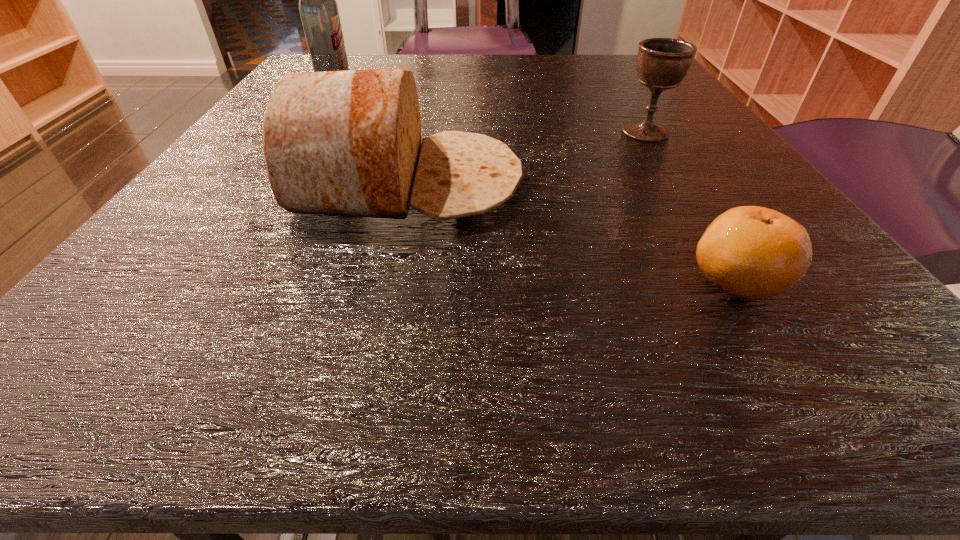
Find the location of a particular element. Image resolution: width=960 pixels, height=540 pixels. vacant space that's between the nearest object and the vodka is located at coordinates (535, 179).

Identify the location of free space between the second object from left to right and the nearest object. (572, 231).

Locate an element on the screen. The width and height of the screenshot is (960, 540). vacant point located between the nearest object and the chalice is located at coordinates (691, 206).

This screenshot has height=540, width=960. Find the location of `the second closest object to the shortest object`. the second closest object to the shortest object is located at coordinates [x=662, y=63].

Identify which object is located as the nearest to the leftmost object. Please provide its 2D coordinates. Your answer should be formatted as a tuple, i.e. [(x, y)], where the tuple contains the x and y coordinates of a point satisfying the conditions above.

[(345, 143)]

What are the coordinates of `free location that satisfies the following two spatial constraints: 1. on the front-facing side of the clementine; 2. on the left side of the farthest object` in the screenshot? It's located at (195, 279).

This screenshot has width=960, height=540. I want to click on vacant region that satisfies the following two spatial constraints: 1. on the front side of the second farthest object; 2. at the sliced end of the bread, so click(x=677, y=183).

The height and width of the screenshot is (540, 960). Identify the location of vacant space that satisfies the following two spatial constraints: 1. on the front-facing side of the leftmost object; 2. on the right side of the nearest object. (195, 279).

You are a GUI agent. You are given a task and a screenshot of the screen. Output one action in this format:
    pyautogui.click(x=<x>, y=<y>)
    Task: Click on the free space in the image that satisfies the following two spatial constraints: 1. on the front side of the chalice; 2. at the sliced end of the bread
    This screenshot has width=960, height=540.
    Given the screenshot: What is the action you would take?
    pyautogui.click(x=677, y=183)

The height and width of the screenshot is (540, 960). In order to click on blank space that satisfies the following two spatial constraints: 1. on the back side of the second farthest object; 2. on the front-facing side of the vodka in this screenshot , I will do `click(612, 78)`.